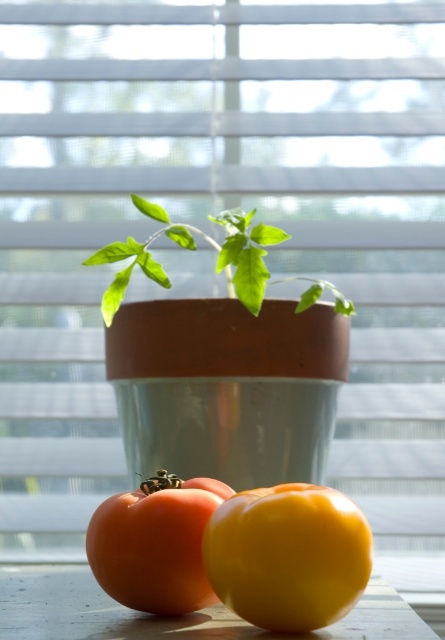
Is the position of smooth wooden table at lower center less distant than that of shiny red tomato at lower left?

Yes, it is.

The width and height of the screenshot is (445, 640). Describe the element at coordinates (169, 618) in the screenshot. I see `smooth wooden table at lower center` at that location.

You are a GUI agent. You are given a task and a screenshot of the screen. Output one action in this format:
    pyautogui.click(x=<x>, y=<y>)
    Task: Click on the smooth wooden table at lower center
    This screenshot has width=445, height=640.
    Given the screenshot: What is the action you would take?
    pyautogui.click(x=169, y=618)

Which is in front, point (178, 608) or point (190, 246)?

Point (178, 608)

In the scene shown: Which of these two, shiny red tomato at lower left or green matte plant at center, stands shorter?

With less height is shiny red tomato at lower left.

Find the location of a particular element. shiny red tomato at lower left is located at coordinates (156, 544).

Is yellow matte bell pepper at lower center thinner than shiny red tomato at lower left?

Incorrect, yellow matte bell pepper at lower center's width is not less than shiny red tomato at lower left's.

Which is below, yellow matte bell pepper at lower center or shiny red tomato at lower left?

shiny red tomato at lower left is lower down.

Does point (238, 522) come closer to viewer compared to point (165, 572)?

Yes, point (238, 522) is in front of point (165, 572).

Find the location of a particular element. The height and width of the screenshot is (640, 445). yellow matte bell pepper at lower center is located at coordinates (287, 556).